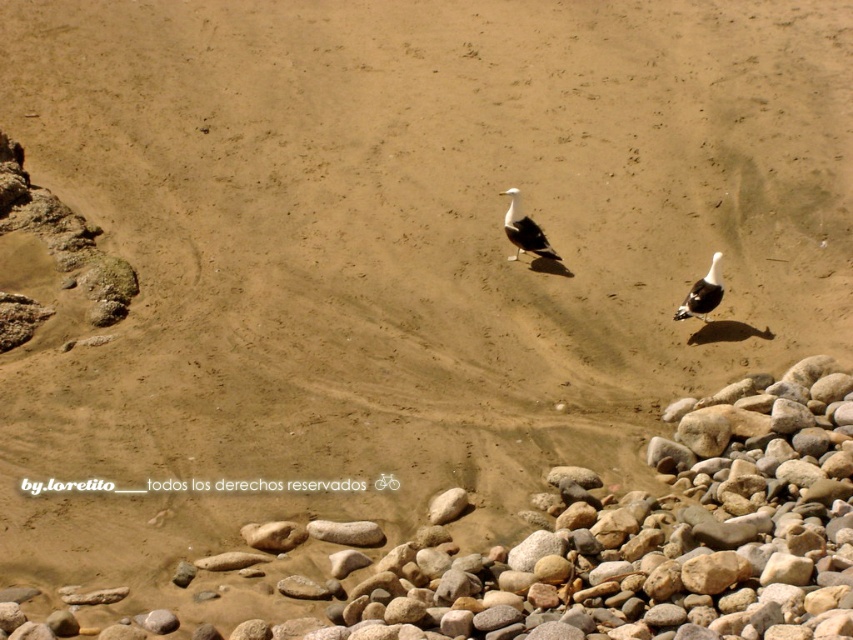
Question: Does white-feathered bird at center have a lesser width compared to white matte bird at center?

Choices:
 (A) yes
 (B) no

Answer: (B)

Question: In this image, where is smooth pebbles at lower right located relative to white matte bird at center?

Choices:
 (A) right
 (B) left

Answer: (B)

Question: Among these objects, which one is farthest from the camera?

Choices:
 (A) white matte bird at center
 (B) white-feathered bird at center

Answer: (B)

Question: In this image, where is smooth pebbles at lower right located relative to white-feathered bird at center?

Choices:
 (A) below
 (B) above

Answer: (A)

Question: Which of the following is the closest to the observer?

Choices:
 (A) (529, 221)
 (B) (672, 413)
 (C) (701, 317)

Answer: (B)

Question: Which object is farther from the camera taking this photo?

Choices:
 (A) white matte bird at center
 (B) smooth pebbles at lower right

Answer: (A)